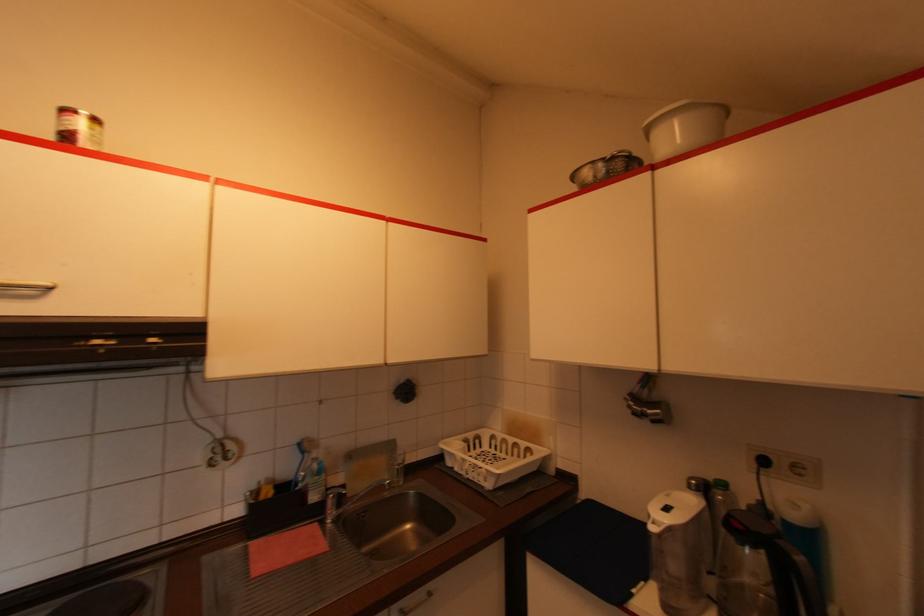
Identify the location of white kettle handle. (707, 537).